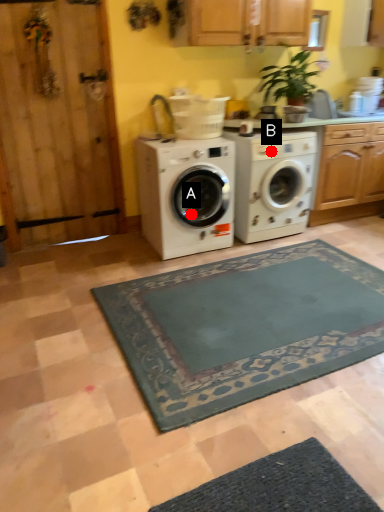
Question: Two points are circled on the image, labeled by A and B beside each circle. Which point is closer to the camera taking this photo?

Choices:
 (A) A is closer
 (B) B is closer

Answer: (A)